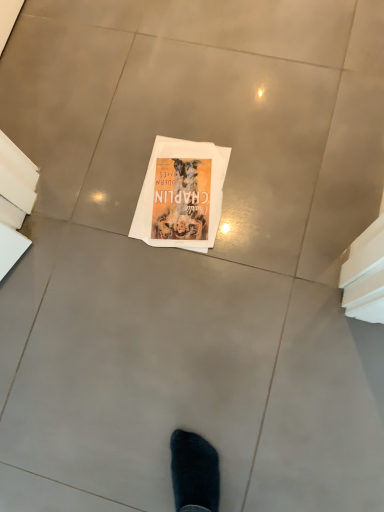
What are the coordinates of `matte paper book at center` in the screenshot? It's located at (181, 195).

What do you see at coordinates (181, 195) in the screenshot? This screenshot has height=512, width=384. I see `matte paper book at center` at bounding box center [181, 195].

Identify the location of matte paper book at center. This screenshot has width=384, height=512. (181, 195).